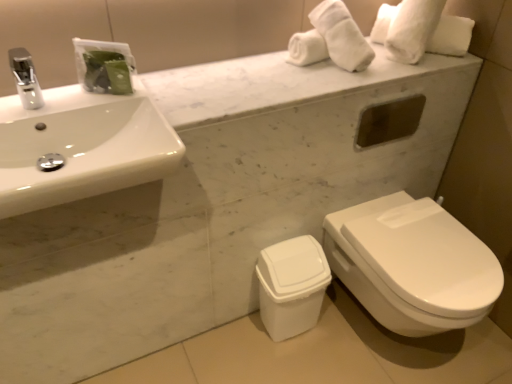
The height and width of the screenshot is (384, 512). I want to click on free location in front of white plastic trash can at lower center, so click(289, 362).